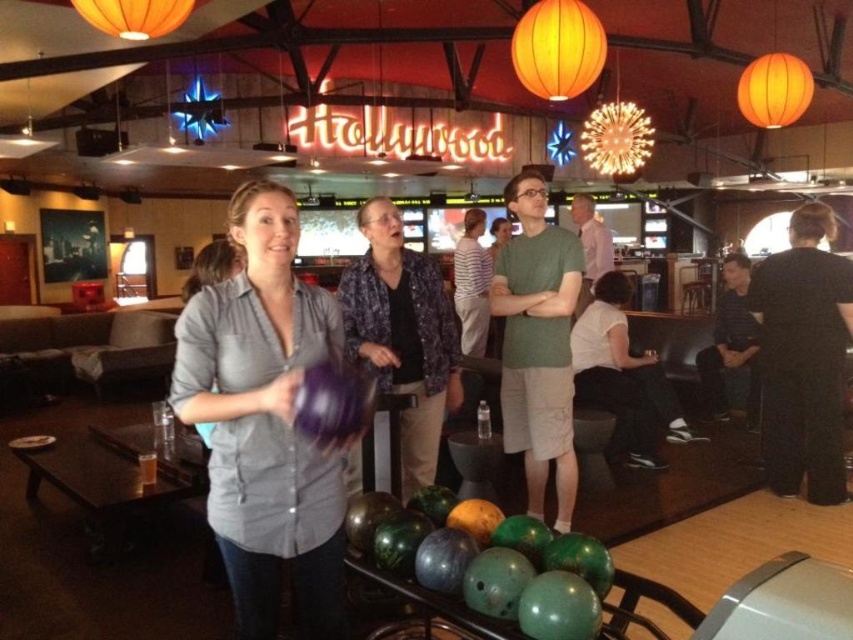
Question: Does matte gray shirt at center appear on the right side of purple floral shirt at center?

Choices:
 (A) yes
 (B) no

Answer: (B)

Question: Which object appears farthest from the camera in this image?

Choices:
 (A) purple floral shirt at center
 (B) matte gray shirt at center

Answer: (A)

Question: Can you confirm if matte gray shirt at center is positioned above purple floral shirt at center?

Choices:
 (A) no
 (B) yes

Answer: (A)

Question: Which object is farther from the camera taking this photo?

Choices:
 (A) purple floral shirt at center
 (B) matte gray shirt at center

Answer: (A)

Question: Where is matte gray shirt at center located in relation to purple floral shirt at center in the image?

Choices:
 (A) left
 (B) right

Answer: (A)

Question: Among these points, which one is nearest to the camera?

Choices:
 (A) (221, 374)
 (B) (438, 385)

Answer: (A)